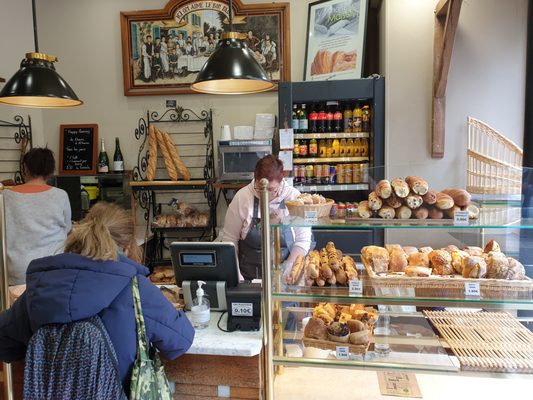
Where is `hand sanitizer`? Image resolution: width=533 pixels, height=400 pixels. hand sanitizer is located at coordinates (201, 305).